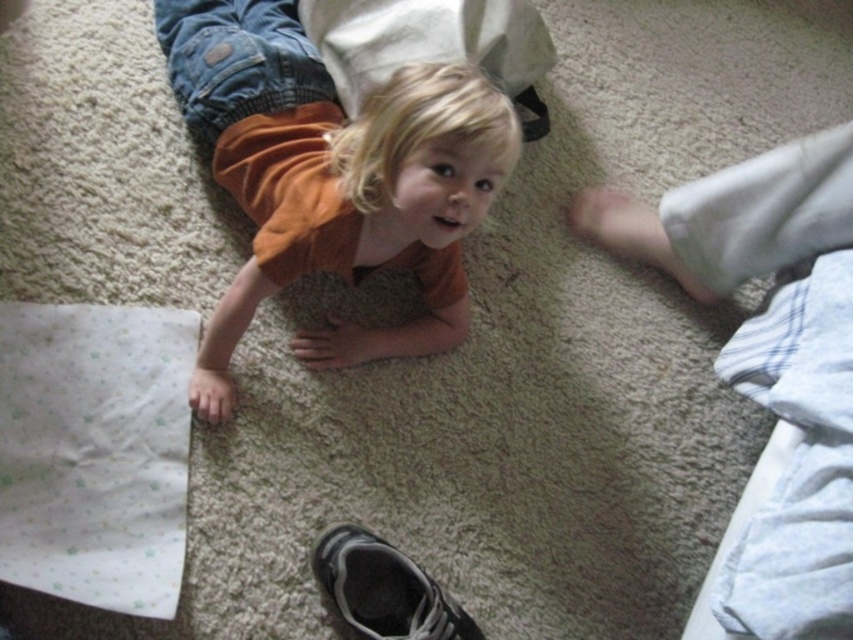
Looking at this image, is the position of orange cotton shirt at center less distant than that of black suede shoe at lower center?

Yes.

Can you confirm if orange cotton shirt at center is smaller than black suede shoe at lower center?

No.

Is point (358, 179) positioned after point (347, 608)?

Yes, it is.

The width and height of the screenshot is (853, 640). I want to click on orange cotton shirt at center, so click(x=334, y=177).

Does matte orange shirt at center appear under black suede shoe at lower center?

Incorrect, matte orange shirt at center is not positioned below black suede shoe at lower center.

Can you confirm if matte orange shirt at center is wider than black suede shoe at lower center?

Indeed, matte orange shirt at center has a greater width compared to black suede shoe at lower center.

Between point (764, 372) and point (340, 554), which one is positioned behind?

The point (764, 372) is behind.

Locate an element on the screen. This screenshot has height=640, width=853. matte orange shirt at center is located at coordinates (772, 358).

Which of these two, orange cotton shirt at center or matte orange shirt at center, stands taller?

Standing taller between the two is matte orange shirt at center.

Does orange cotton shirt at center have a lesser width compared to matte orange shirt at center?

Yes, orange cotton shirt at center is thinner than matte orange shirt at center.

Between point (366, 344) and point (744, 580), which one is positioned in front?

Point (744, 580) is more forward.

Locate an element on the screen. The height and width of the screenshot is (640, 853). orange cotton shirt at center is located at coordinates (334, 177).